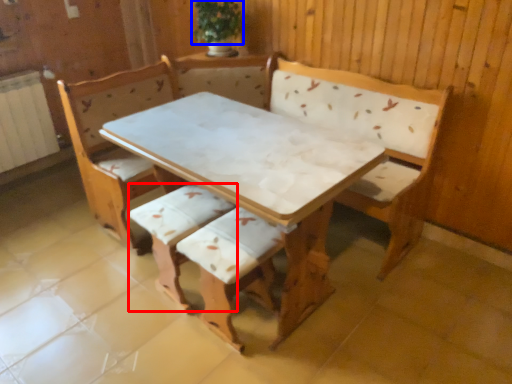
Question: Which object appears closest to the camera in this image, armchair (highlighted by a red box) or plant (highlighted by a blue box)?

Choices:
 (A) armchair
 (B) plant

Answer: (A)